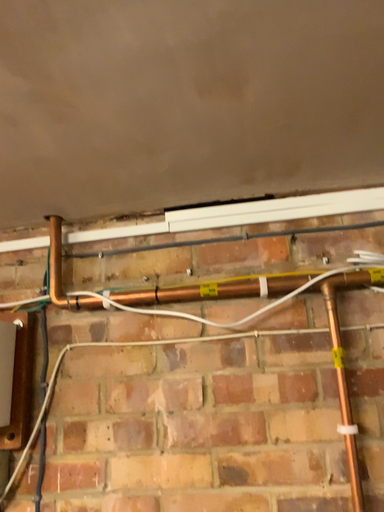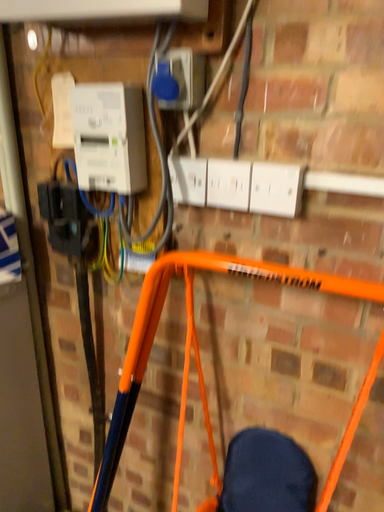
Question: Which way did the camera rotate in the video?

Choices:
 (A) rotated left
 (B) rotated right

Answer: (A)